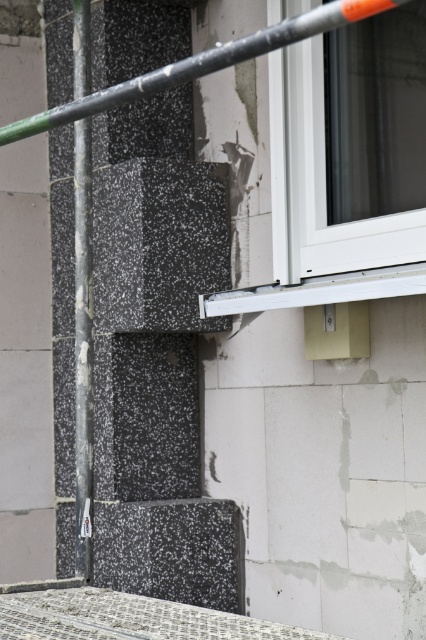
You are an inspector checking the construction site. You notice two poles, the black textured pole at left and the metallic gray pole at upper center. Which pole is taller?

The black textured pole at left is taller than the metallic gray pole at upper center.

You are a contractor assessing the construction site. You notice the white plastic window at upper right and the black textured pole at left. Which object has a smaller height?

The white plastic window at upper right has a lesser height compared to the black textured pole at left, so the white plastic window at upper right is smaller in height.